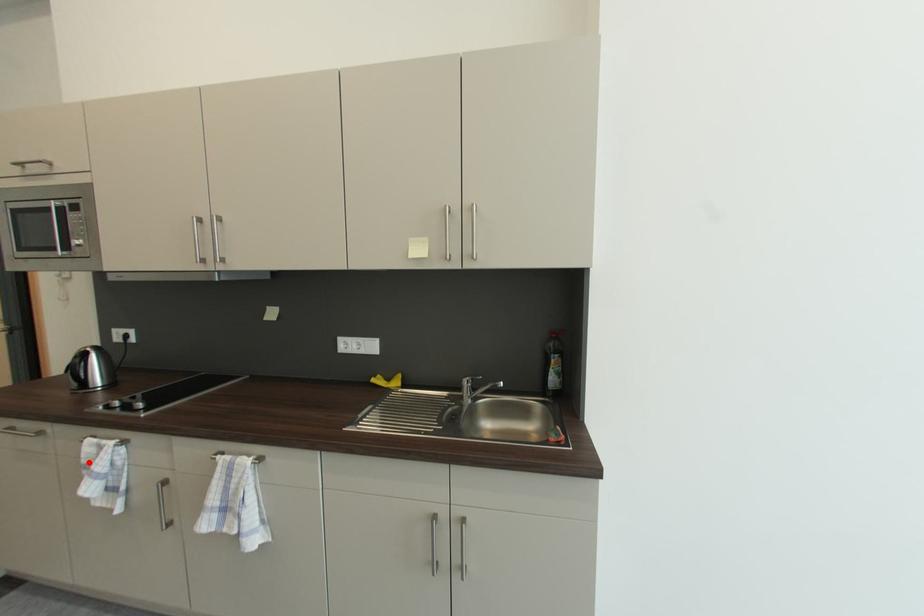
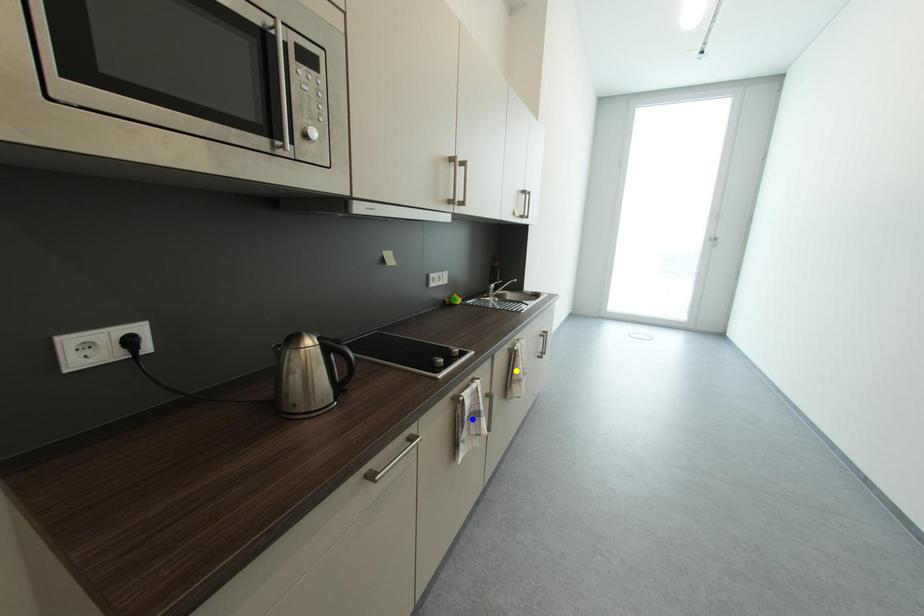
Question: I am providing you with two images of the same scene from different viewpoints. A red point is marked on the first image. You are given multiple points on the second image. Which spot in image 2 lines up with the point in image 1?

Choices:
 (A) blue point
 (B) green point
 (C) yellow point

Answer: (A)